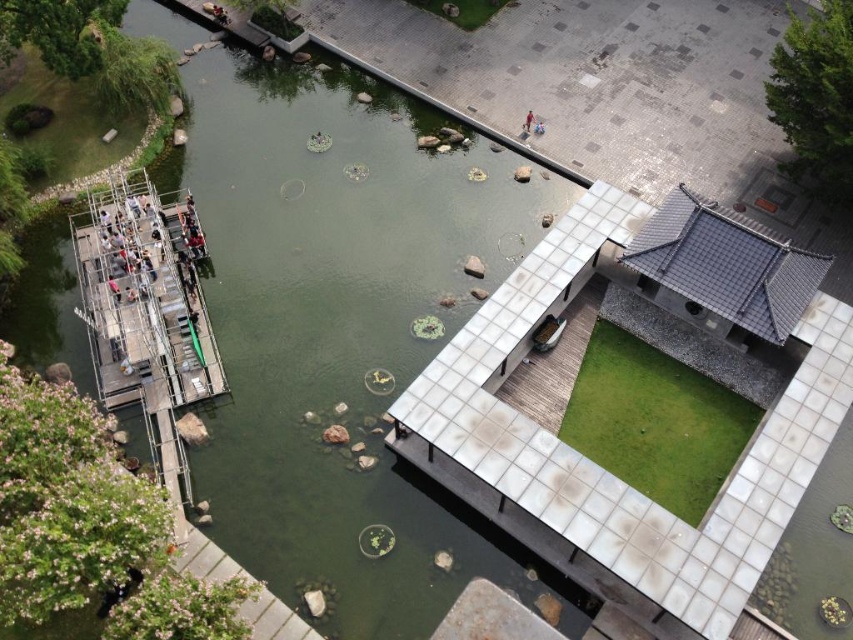
Question: Based on their relative distances, which object is farther from the metallic silver boat at center?

Choices:
 (A) red fabric person at center
 (B) metallic dock at left

Answer: (B)

Question: Is metallic dock at left above red fabric person at center?

Choices:
 (A) no
 (B) yes

Answer: (A)

Question: Where is metallic silver boat at center located in relation to red fabric person at center in the image?

Choices:
 (A) left
 (B) right

Answer: (B)

Question: Which object is farther from the camera taking this photo?

Choices:
 (A) metallic dock at left
 (B) metallic silver boat at center
 (C) red fabric person at center

Answer: (C)

Question: Among these points, which one is farthest from the camera?

Choices:
 (A) (546, 330)
 (B) (154, 321)

Answer: (A)

Question: Is metallic dock at left to the left of metallic silver boat at center from the viewer's perspective?

Choices:
 (A) no
 (B) yes

Answer: (B)